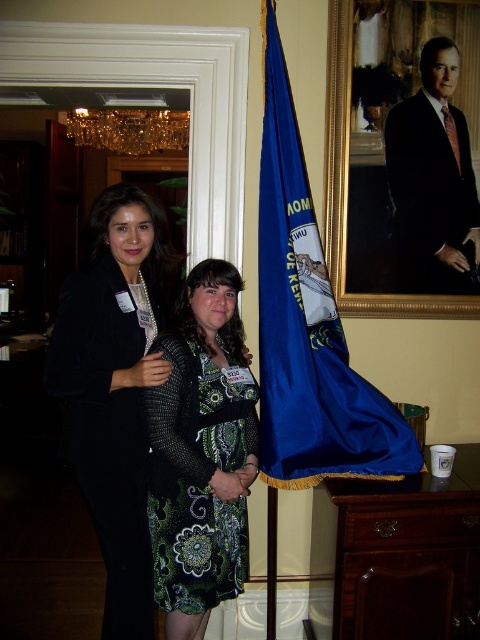
You are a photographer at an event and need to capture a photo of the black textured blazer at center and the blue fabric flag at center. Based on their positions, which object is located to the left of the other?

The black textured blazer at center is positioned on the left side of blue fabric flag at center, so the blazer is to the left of the flag.